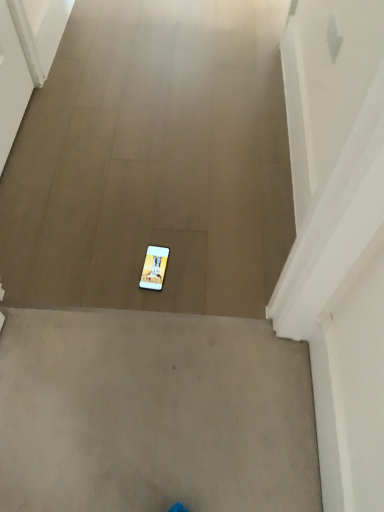
Question: From the image's perspective, is white matte phone at center under white glossy mobile phone at center?

Choices:
 (A) yes
 (B) no

Answer: (B)

Question: From a real-world perspective, is white matte phone at center over white glossy mobile phone at center?

Choices:
 (A) no
 (B) yes

Answer: (B)

Question: Is white matte phone at center bigger than white glossy mobile phone at center?

Choices:
 (A) no
 (B) yes

Answer: (B)

Question: Is white matte phone at center oriented away from white glossy mobile phone at center?

Choices:
 (A) no
 (B) yes

Answer: (A)

Question: Considering the relative sizes of white matte phone at center and white glossy mobile phone at center in the image provided, is white matte phone at center wider than white glossy mobile phone at center?

Choices:
 (A) no
 (B) yes

Answer: (B)

Question: Can you confirm if white matte phone at center is smaller than white glossy mobile phone at center?

Choices:
 (A) no
 (B) yes

Answer: (A)

Question: Can you confirm if white glossy mobile phone at center is wider than white matte phone at center?

Choices:
 (A) yes
 (B) no

Answer: (B)

Question: Considering the relative positions of white glossy mobile phone at center and white matte phone at center in the image provided, is white glossy mobile phone at center to the right of white matte phone at center from the viewer's perspective?

Choices:
 (A) no
 (B) yes

Answer: (B)

Question: Is white glossy mobile phone at center taller than white matte phone at center?

Choices:
 (A) no
 (B) yes

Answer: (A)

Question: Can you confirm if white glossy mobile phone at center is shorter than white matte phone at center?

Choices:
 (A) no
 (B) yes

Answer: (B)

Question: Is white matte phone at center surrounded by white glossy mobile phone at center?

Choices:
 (A) yes
 (B) no

Answer: (B)

Question: Does white glossy mobile phone at center have a smaller size compared to white matte phone at center?

Choices:
 (A) no
 (B) yes

Answer: (B)

Question: From the image's perspective, is white glossy mobile phone at center located above or below white matte phone at center?

Choices:
 (A) above
 (B) below

Answer: (B)